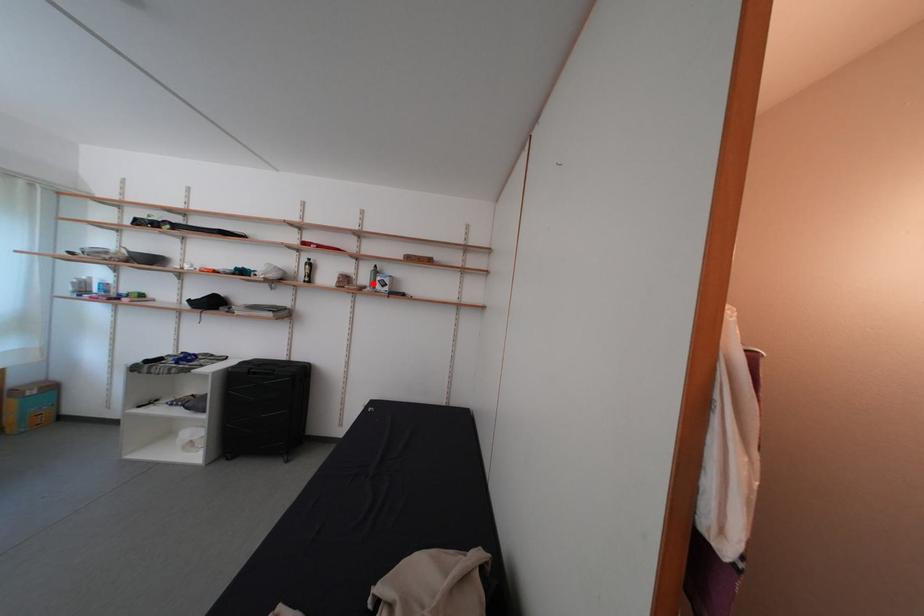
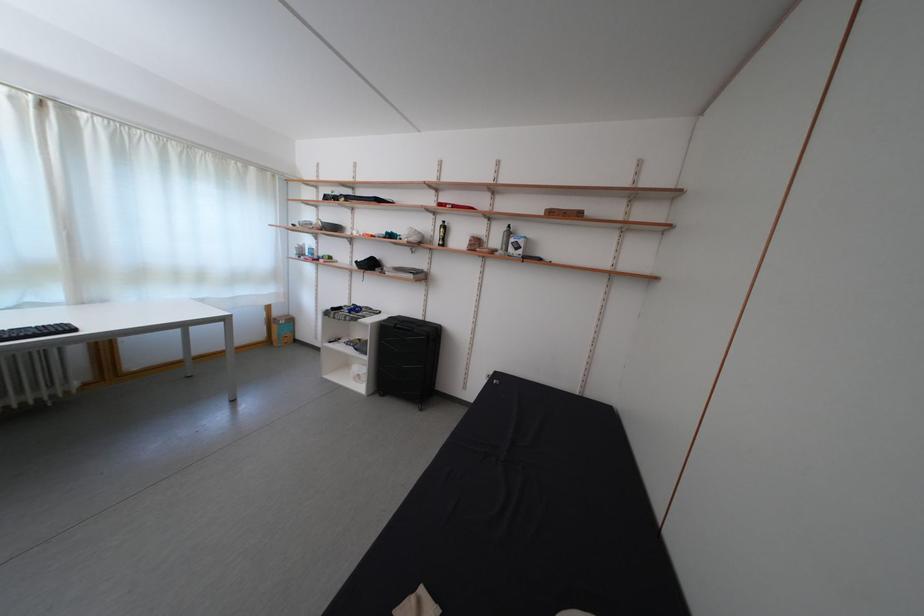
Locate, in the second image, the point that corresponds to the highlighted location in the first image.

(505, 246)